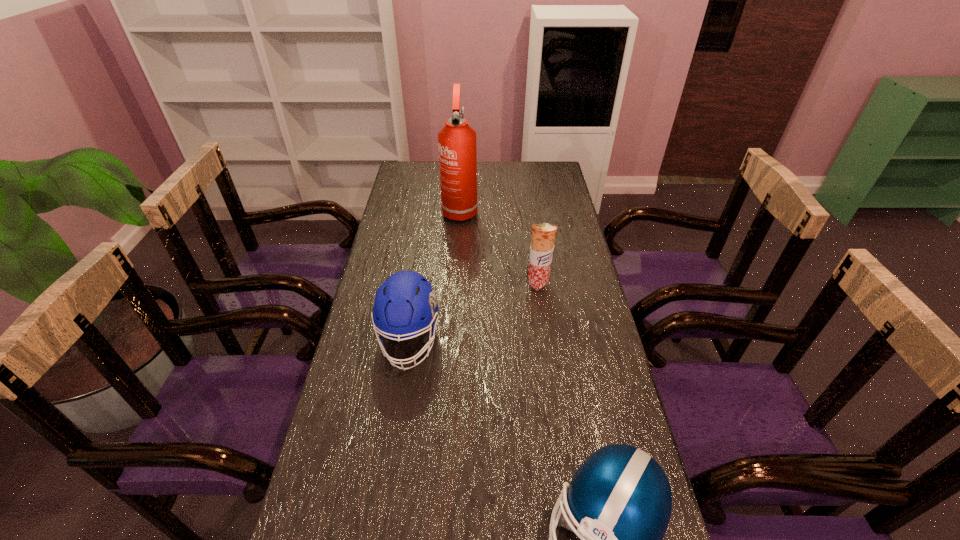
In the image, there is a desktop. Where is `vacant space at the far edge`? The height and width of the screenshot is (540, 960). vacant space at the far edge is located at coordinates (496, 185).

In the image, there is a desktop. Identify the location of vacant space at the left edge. (395, 394).

The image size is (960, 540). I want to click on vacant space at the right edge of the desktop, so click(x=577, y=247).

The height and width of the screenshot is (540, 960). What are the coordinates of `vacant point located between the fire extinguisher and the farther football helmet` in the screenshot? It's located at (435, 275).

Identify the location of vacant space that is in between the burrito and the farthest object. This screenshot has height=540, width=960. (499, 247).

Locate an element on the screen. free space that is in between the burrito and the farther football helmet is located at coordinates (473, 313).

You are a GUI agent. You are given a task and a screenshot of the screen. Output one action in this format:
    pyautogui.click(x=<x>, y=<y>)
    Task: Click on the unoccupied area between the tallest object and the farther football helmet
    The image size is (960, 540).
    Given the screenshot: What is the action you would take?
    pyautogui.click(x=435, y=275)

The width and height of the screenshot is (960, 540). Identify the location of object that can be found as the second closest to the nearer football helmet. (543, 235).

Choose which object is the second nearest neighbor to the right football helmet. Please provide its 2D coordinates. Your answer should be formatted as a tuple, i.e. [(x, y)], where the tuple contains the x and y coordinates of a point satisfying the conditions above.

[(543, 235)]

Find the location of a particular element. This screenshot has width=960, height=540. vacant point that satisfies the following two spatial constraints: 1. at the nozzle of the burrito; 2. on the right side of the tallest object is located at coordinates (455, 284).